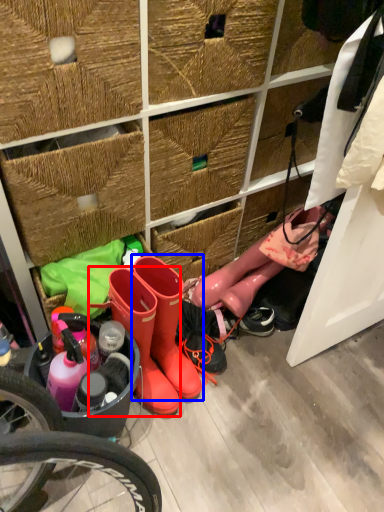
Question: Which of the following is the farthest to the observer, footwear (highlighted by a red box) or footwear (highlighted by a blue box)?

Choices:
 (A) footwear
 (B) footwear

Answer: (B)